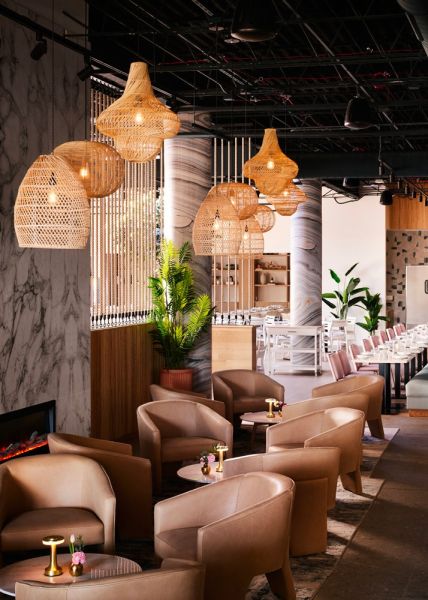
Identify the location of round table. The width and height of the screenshot is (428, 600). (101, 568), (187, 474), (268, 420).